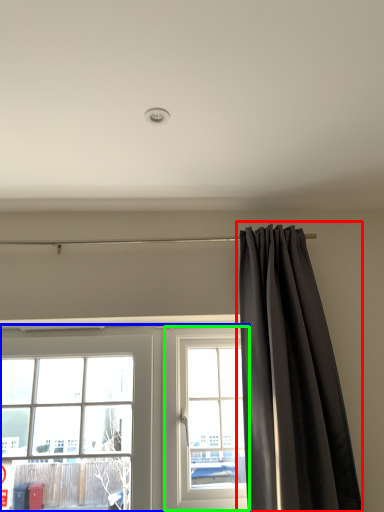
Question: Based on their relative distances, which object is farther from curtain (highlighted by a red box)? Choose from window (highlighted by a blue box) and window (highlighted by a green box).

Choices:
 (A) window
 (B) window

Answer: (A)